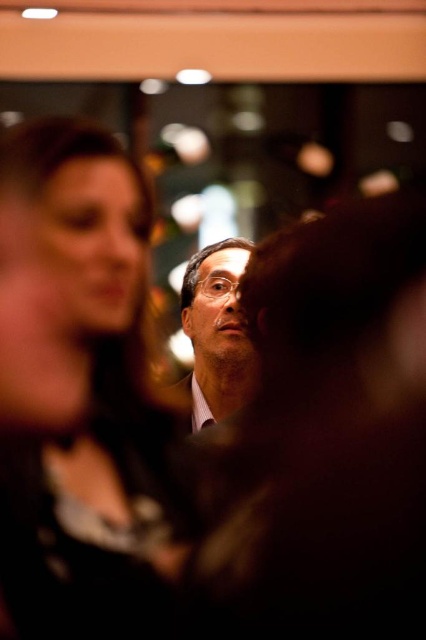
Looking at this image, you are a photographer at the event and want to adjust your camera to focus on both the matte black dress at upper left and the matte black glasses at center. Since the dress is on the left side of the glasses, which object should you focus on first to ensure both are in focus?

The matte black dress at upper left is positioned on the left side of matte black glasses at center. To ensure both are in focus, you should focus on the matte black glasses at center first because it is closer to the camera than the dress, allowing the depth of field to cover both objects.

You are a photographer at the event and want to ensure both the matte black dress at upper left and the matte black glasses at center are visible in your next photo. Which object should you adjust your focus to prioritize based on their sizes?

The matte black dress at upper left is larger in size than the matte black glasses at center, so you should prioritize focusing on the matte black dress at upper left to ensure it is clearly visible in the photo.